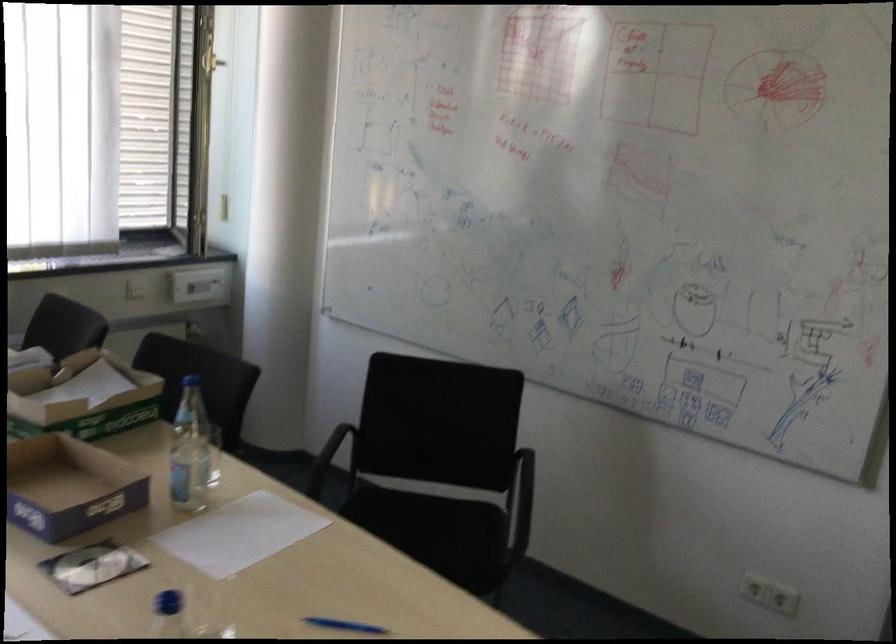
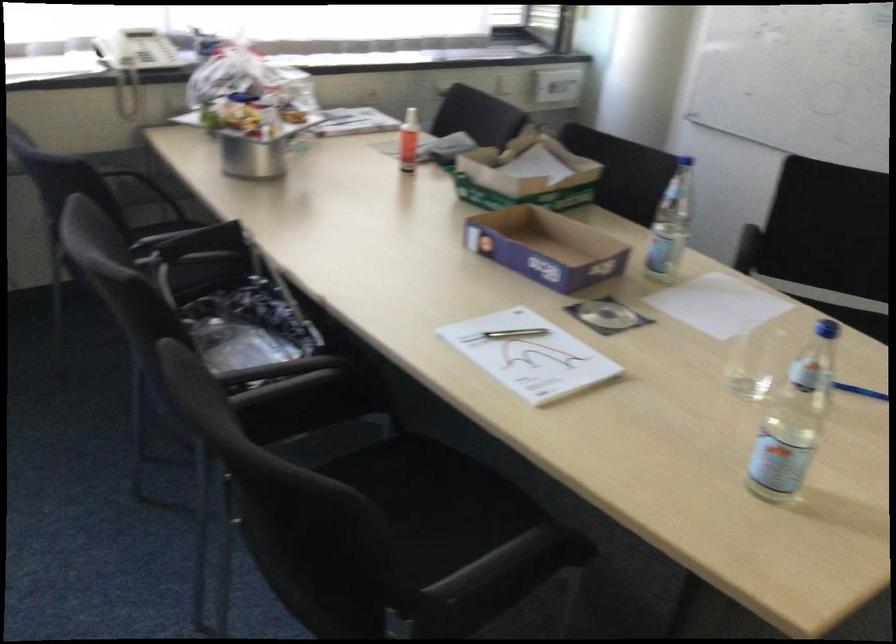
In the second image, find the point that corresponds to [71,488] in the first image.

(546, 247)